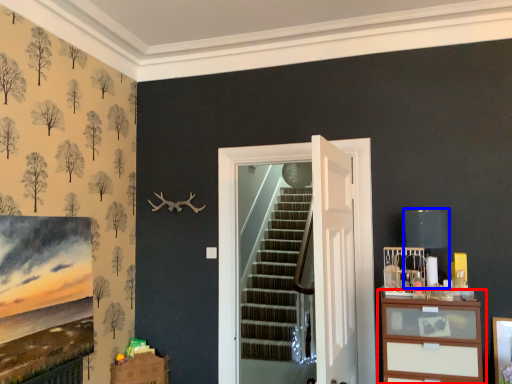
Question: Which object is closer to the camera taking this photo, chest of drawers (highlighted by a red box) or lamp (highlighted by a blue box)?

Choices:
 (A) chest of drawers
 (B) lamp

Answer: (A)